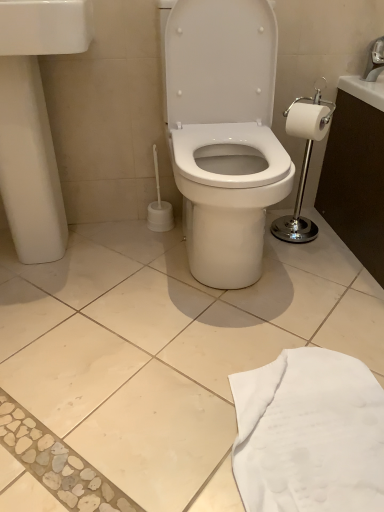
Question: From their relative heights in the image, would you say white fabric at lower right is taller or shorter than white glossy toilet paper at right?

Choices:
 (A) short
 (B) tall

Answer: (A)

Question: Relative to white glossy toilet paper at right, is white fabric at lower right in front or behind?

Choices:
 (A) front
 (B) behind

Answer: (A)

Question: Based on their relative distances, which object is farther from the white glossy sink at left?

Choices:
 (A) white glossy toilet paper at right
 (B) silver metallic faucet at upper right
 (C) white fabric at lower right

Answer: (B)

Question: Estimate the real-world distances between objects in this image. Which object is farther from the white fabric at lower right?

Choices:
 (A) white glossy sink at left
 (B) silver metallic faucet at upper right
 (C) white glossy toilet paper at right

Answer: (B)